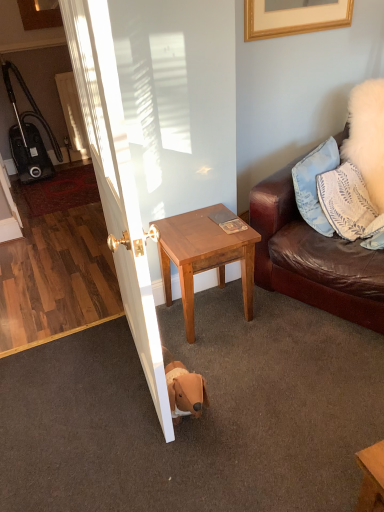
I want to click on space that is in front of white glossy door at center, so click(x=143, y=454).